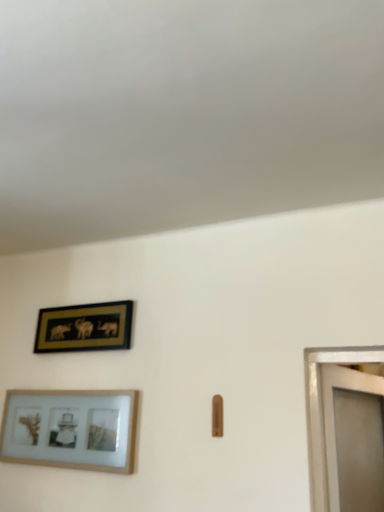
Question: Does point (112, 396) appear closer or farther from the camera than point (125, 322)?

Choices:
 (A) farther
 (B) closer

Answer: (B)

Question: Considering the positions of wooden picture frame at lower left, which is counted as the 2th picture frame, starting from the top, and gold-framed artwork at upper left, the second picture frame positioned from the bottom, in the image, is wooden picture frame at lower left, which is counted as the 2th picture frame, starting from the top, taller or shorter than gold-framed artwork at upper left, the second picture frame positioned from the bottom,?

Choices:
 (A) tall
 (B) short

Answer: (A)

Question: In terms of width, does wooden picture frame at lower left, marked as the 1th picture frame in a bottom-to-top arrangement, look wider or thinner when compared to gold-framed artwork at upper left, the second picture frame positioned from the bottom?

Choices:
 (A) thin
 (B) wide

Answer: (B)

Question: Is gold-framed artwork at upper left, which is the first picture frame from top to bottom, in front of or behind wooden picture frame at lower left, marked as the 1th picture frame in a bottom-to-top arrangement, in the image?

Choices:
 (A) front
 (B) behind

Answer: (B)

Question: From the image's perspective, is gold-framed artwork at upper left, which is the first picture frame from top to bottom, positioned above or below wooden picture frame at lower left, which is counted as the 2th picture frame, starting from the top?

Choices:
 (A) above
 (B) below

Answer: (A)

Question: Looking at their shapes, would you say gold-framed artwork at upper left, which is the first picture frame from top to bottom, is wider or thinner than wooden picture frame at lower left, marked as the 1th picture frame in a bottom-to-top arrangement?

Choices:
 (A) thin
 (B) wide

Answer: (A)

Question: Is point (102, 332) closer or farther from the camera than point (84, 435)?

Choices:
 (A) farther
 (B) closer

Answer: (A)